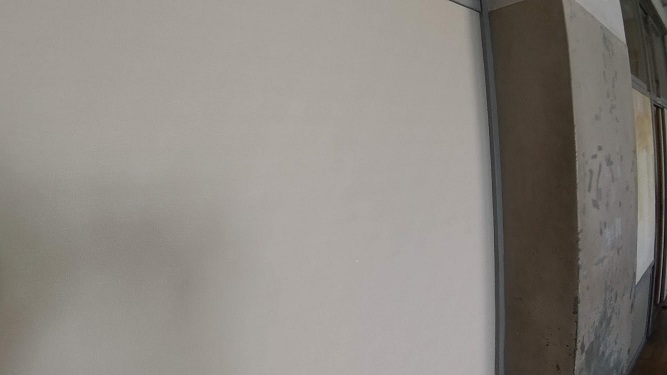
Image resolution: width=667 pixels, height=375 pixels. Identify the location of door frame. (657, 271).